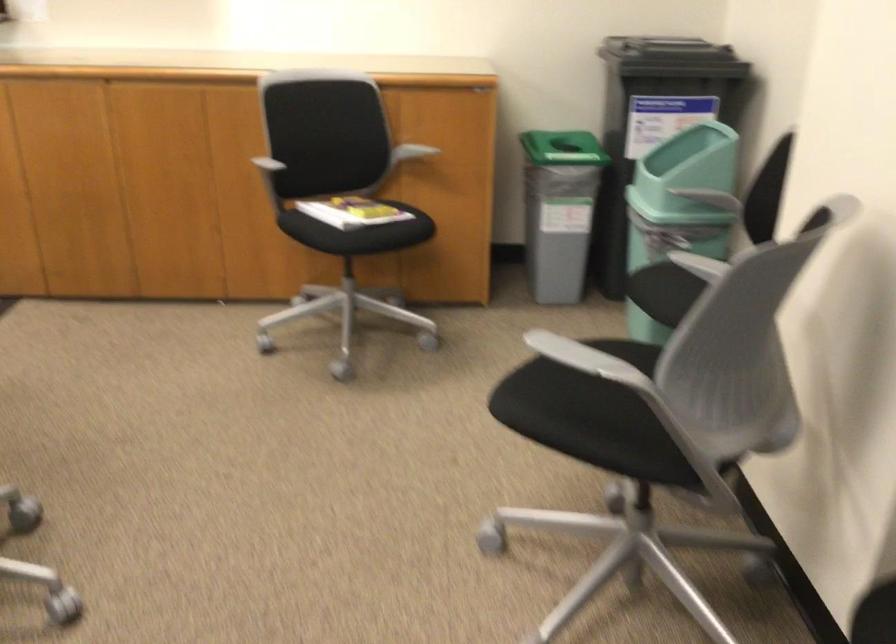
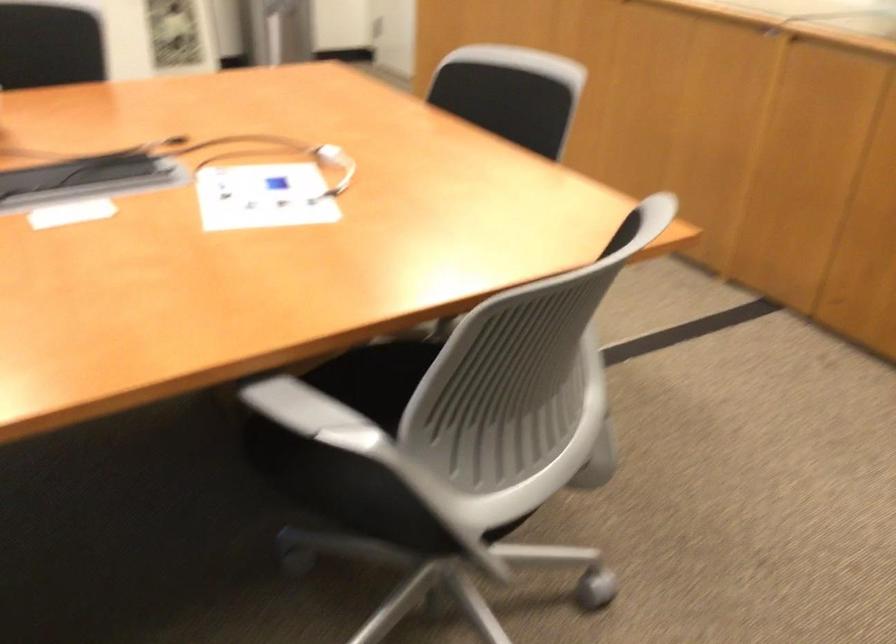
Question: The images are taken continuously from a first-person perspective. In which direction is your viewpoint rotating?

Choices:
 (A) Left
 (B) Right
 (C) Up
 (D) Down

Answer: (A)